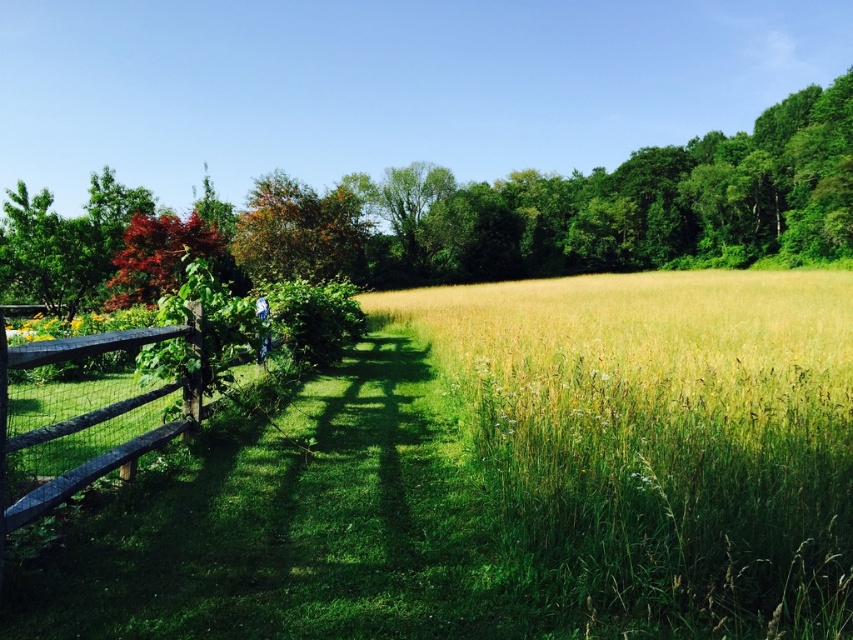
You are standing in the rural scene and notice the green leafy tree at upper left and the shiny red maple leaf at upper left. Which object would block your view more if you were looking towards them from the pathway?

The green leafy tree at upper left would block your view more because it has a larger size compared to the shiny red maple leaf at upper left.

You are standing in the rural scene and want to take a photo of the green leafy tree at upper left. If your camera can focus on objects up to 20 meters away, will you be able to capture a clear photo of the tree?

The green leafy tree at upper left is 19.41 meters from viewer, so yes, the camera can focus on it clearly since it is within the 20 meters range.

You are a hiker standing on the pathway in the center of the scene. You want to walk straight towards the green leafy tree at upper left and the shiny red maple leaf at upper left. Which one will you reach first?

The green leafy tree at upper left and the shiny red maple leaf at upper left are 43.33 meters apart from each other. Since they are both at the same upper left position in the scene, you will reach them at the same time.